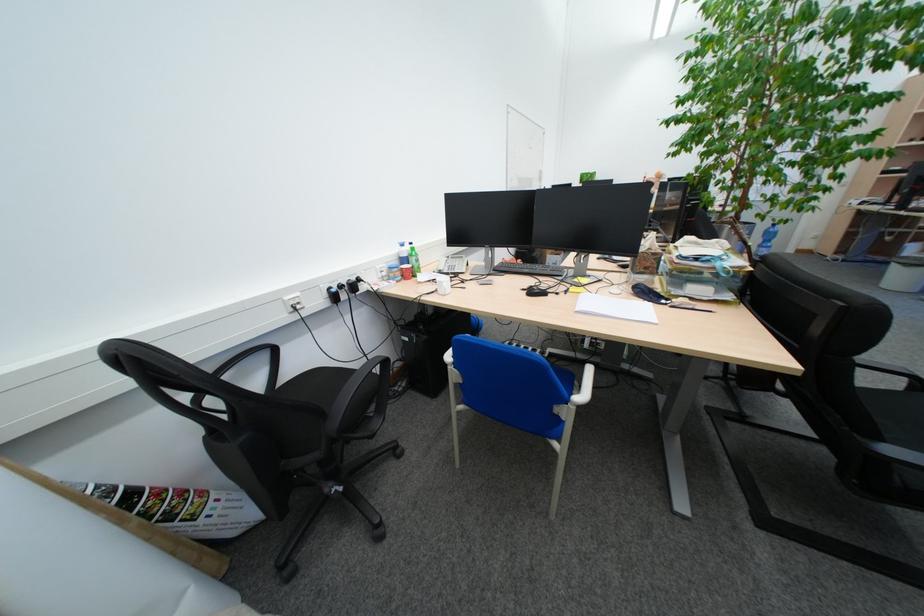
This screenshot has height=616, width=924. Find the location of `green label bottle`. green label bottle is located at coordinates 414,259.